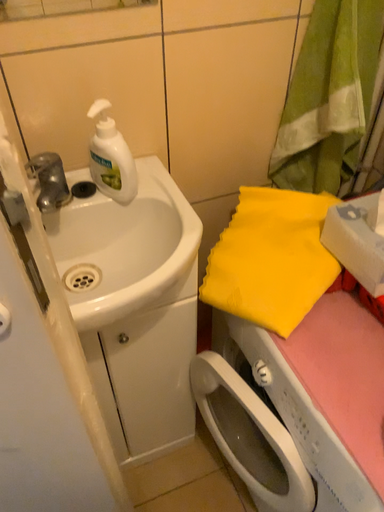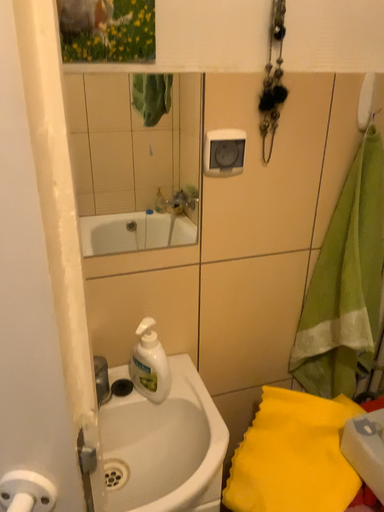
Question: How did the camera likely rotate when shooting the video?

Choices:
 (A) rotated upward
 (B) rotated downward

Answer: (A)